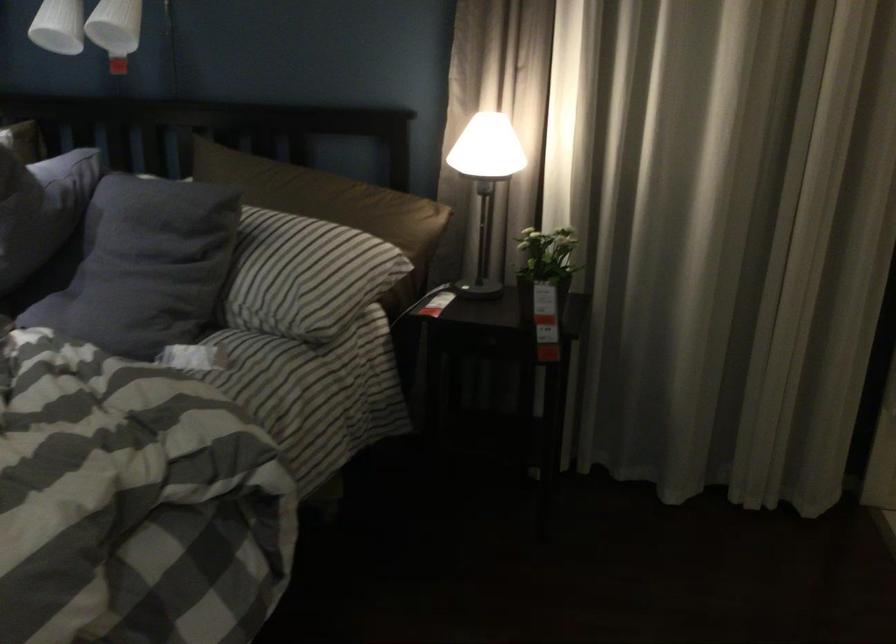
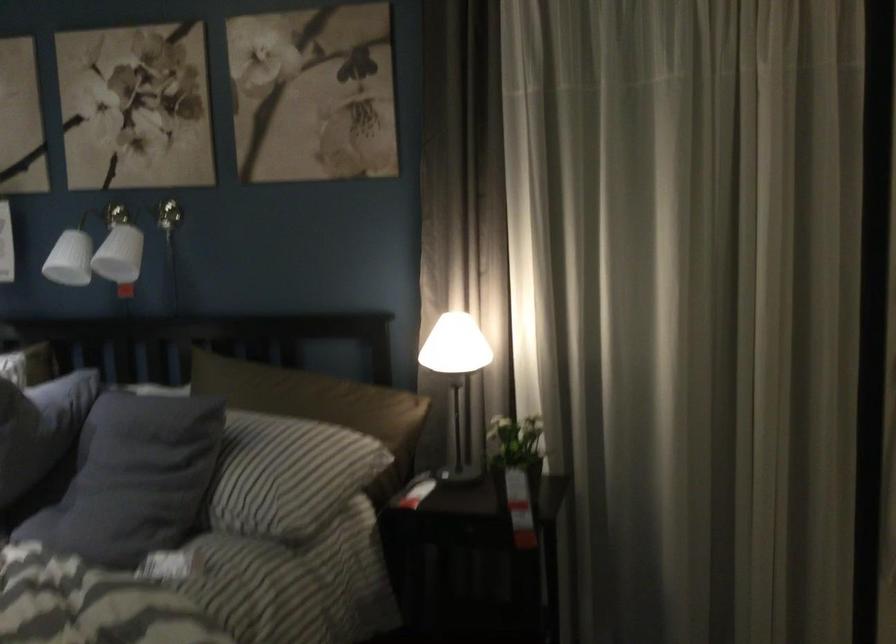
Question: The first image is from the beginning of the video and the second image is from the end. How did the camera likely rotate when shooting the video?

Choices:
 (A) Left
 (B) Right
 (C) Up
 (D) Down

Answer: (C)